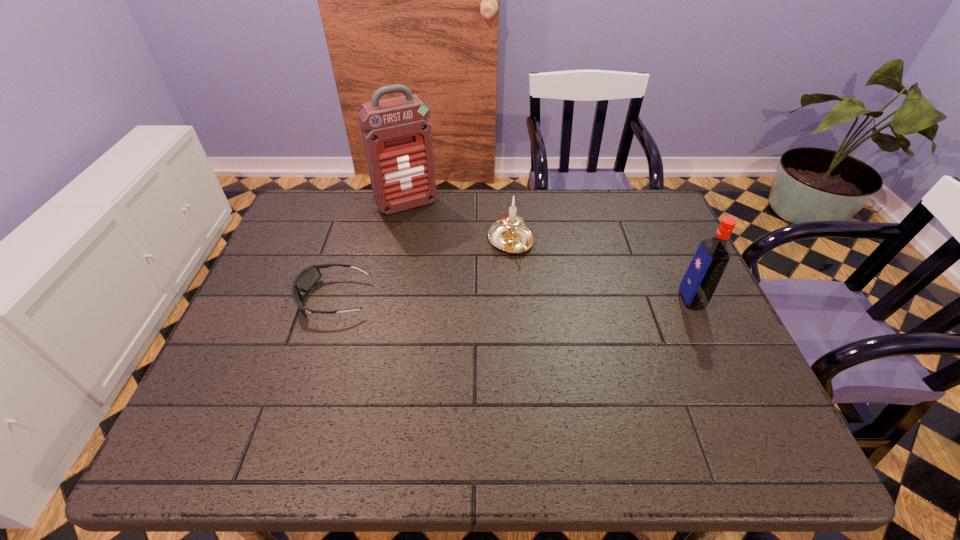
The width and height of the screenshot is (960, 540). In order to click on vacant space that is in between the rightmost object and the goggles in this screenshot , I will do `click(513, 299)`.

At what (x,y) coordinates should I click in order to perform the action: click on free space that is in between the farthest object and the third tallest object. Please return your answer as a coordinate pair (x, y). The height and width of the screenshot is (540, 960). Looking at the image, I should click on (459, 224).

The height and width of the screenshot is (540, 960). In order to click on free space between the rightmost object and the third nearest object in this screenshot , I will do `click(601, 271)`.

This screenshot has width=960, height=540. I want to click on vacant space that is in between the candle holder and the goggles, so click(x=422, y=270).

Where is `unoccupied position between the first-aid kit and the second shortest object`? The image size is (960, 540). unoccupied position between the first-aid kit and the second shortest object is located at coordinates (459, 224).

Where is `vacant point located between the goggles and the tallest object`? This screenshot has height=540, width=960. vacant point located between the goggles and the tallest object is located at coordinates (371, 251).

Find the location of `the second closest object to the tallest object`. the second closest object to the tallest object is located at coordinates (304, 281).

This screenshot has width=960, height=540. I want to click on object that is the third closest to the third object from left to right, so click(702, 277).

The width and height of the screenshot is (960, 540). Identify the location of free space that satisfies the following two spatial constraints: 1. on the front side of the tallest object; 2. on the left side of the second shortest object. (399, 242).

Identify the location of free region that satisfies the following two spatial constraints: 1. on the front side of the vodka; 2. on the front and back of the tallest object. (388, 300).